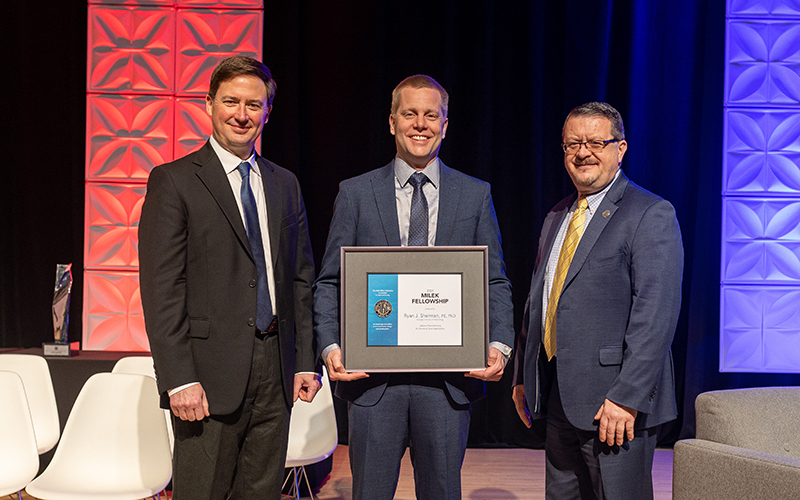
This screenshot has width=800, height=500. What are the coordinates of `grey chair` in the screenshot? It's located at (738, 420), (721, 471).